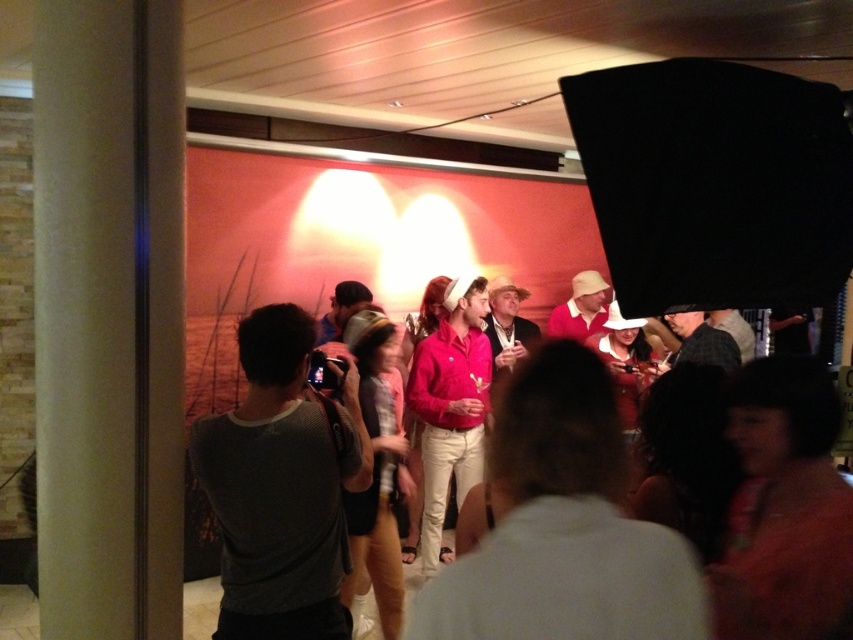
Question: Can you confirm if gray mesh shirt at left is smaller than matte pink shirt at center?

Choices:
 (A) yes
 (B) no

Answer: (A)

Question: Which object appears closest to the camera in this image?

Choices:
 (A) matte pink shirt at center
 (B) gray mesh shirt at left

Answer: (B)

Question: In this image, where is gray mesh shirt at left located relative to matte pink shirt at center?

Choices:
 (A) above
 (B) below

Answer: (B)

Question: Can you confirm if gray mesh shirt at left is positioned above matte pink shirt at center?

Choices:
 (A) no
 (B) yes

Answer: (A)

Question: Which point appears closest to the camera in this image?

Choices:
 (A) (212, 385)
 (B) (288, 368)

Answer: (B)